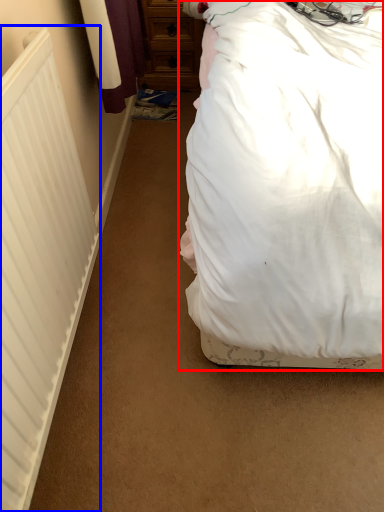
Question: Which object is further to the camera taking this photo, bed (highlighted by a red box) or radiator (highlighted by a blue box)?

Choices:
 (A) bed
 (B) radiator

Answer: (B)